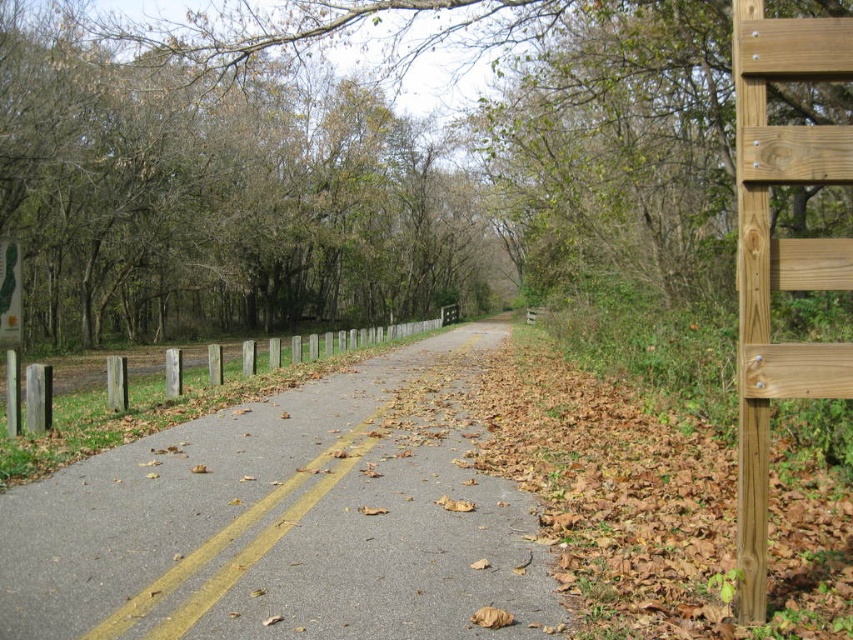
Can you confirm if gray asphalt road at center is shorter than green plastic sign at left?

Correct, gray asphalt road at center is not as tall as green plastic sign at left.

Who is lower down, gray asphalt road at center or green plastic sign at left?

Positioned lower is gray asphalt road at center.

Between point (469, 576) and point (15, 288), which one is positioned behind?

Positioned behind is point (15, 288).

This screenshot has width=853, height=640. In order to click on gray asphalt road at center in this screenshot , I will do `click(281, 525)`.